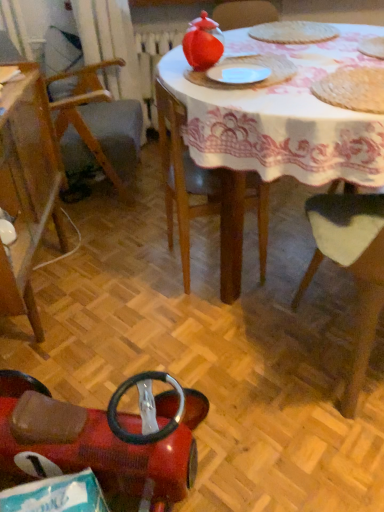
Where is `vacant area on the back side of wooden chair at lower right, the 3th chair in the left-to-right sequence`? This screenshot has height=512, width=384. vacant area on the back side of wooden chair at lower right, the 3th chair in the left-to-right sequence is located at coordinates (291, 268).